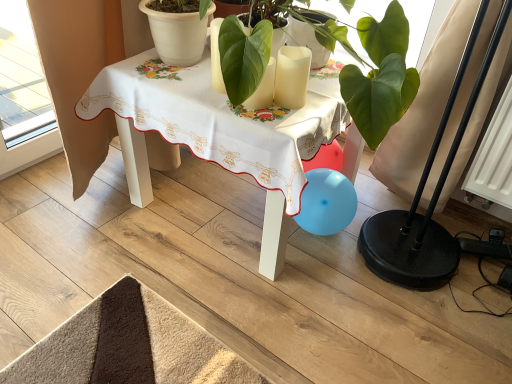
Locate an element on the screen. This screenshot has height=384, width=512. vacant space to the left of white matte candle at center is located at coordinates (206, 90).